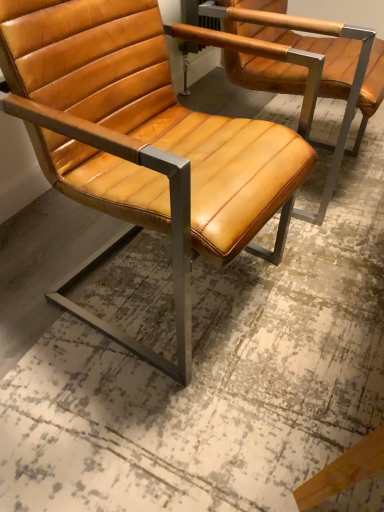
The height and width of the screenshot is (512, 384). What do you see at coordinates (143, 139) in the screenshot?
I see `matte leather chair at center` at bounding box center [143, 139].

The height and width of the screenshot is (512, 384). What are the coordinates of `matte leather chair at center` in the screenshot? It's located at (143, 139).

Identify the location of matte leather chair at center. (143, 139).